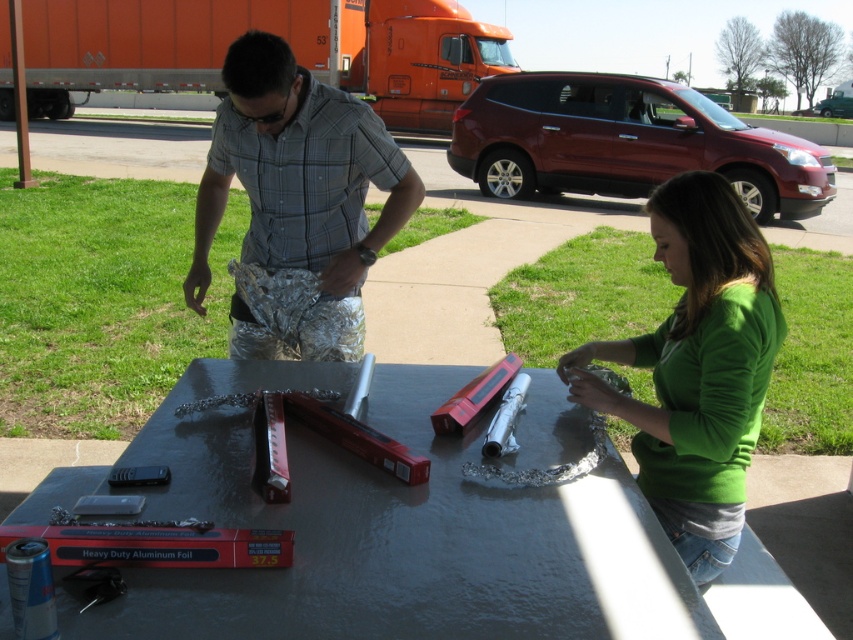
Question: Which object is positioned closest to the orange aluminum trailer truck at upper left?

Choices:
 (A) silver reflective foil at center
 (B) metallic gray table at center
 (C) green matte shirt at center

Answer: (A)

Question: Which object appears closest to the camera in this image?

Choices:
 (A) silver reflective foil at center
 (B) metallic gray table at center
 (C) green matte shirt at center
 (D) orange aluminum trailer truck at upper left

Answer: (B)

Question: Does metallic gray table at center lie in front of green matte shirt at center?

Choices:
 (A) yes
 (B) no

Answer: (A)

Question: Which point appears farthest from the camera in this image?

Choices:
 (A) (329, 449)
 (B) (245, 177)

Answer: (B)

Question: Does metallic gray table at center have a larger size compared to green matte shirt at center?

Choices:
 (A) no
 (B) yes

Answer: (B)

Question: Does silver reflective foil at center appear over orange aluminum trailer truck at upper left?

Choices:
 (A) no
 (B) yes

Answer: (A)